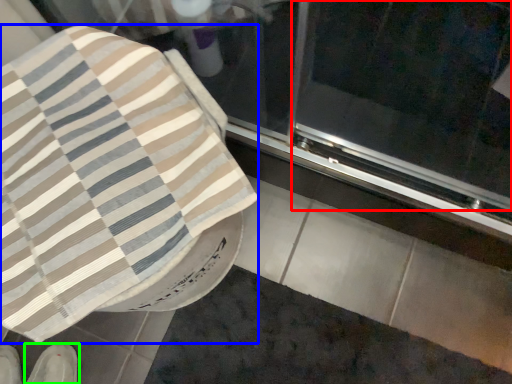
Question: Which object is the closest to the screen door (highlighted by a red box)? Choose among these: blanket (highlighted by a blue box) or footwear (highlighted by a green box).

Choices:
 (A) blanket
 (B) footwear

Answer: (A)